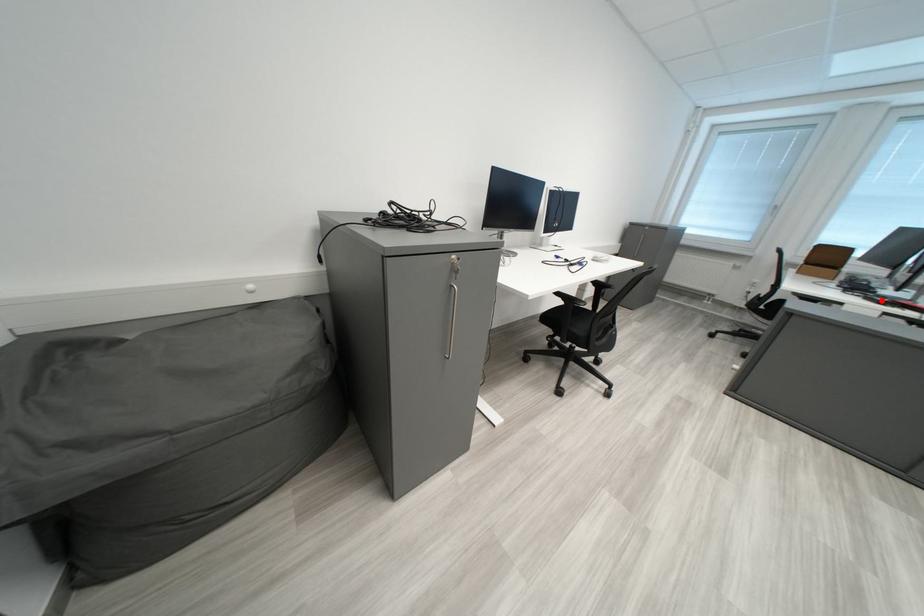
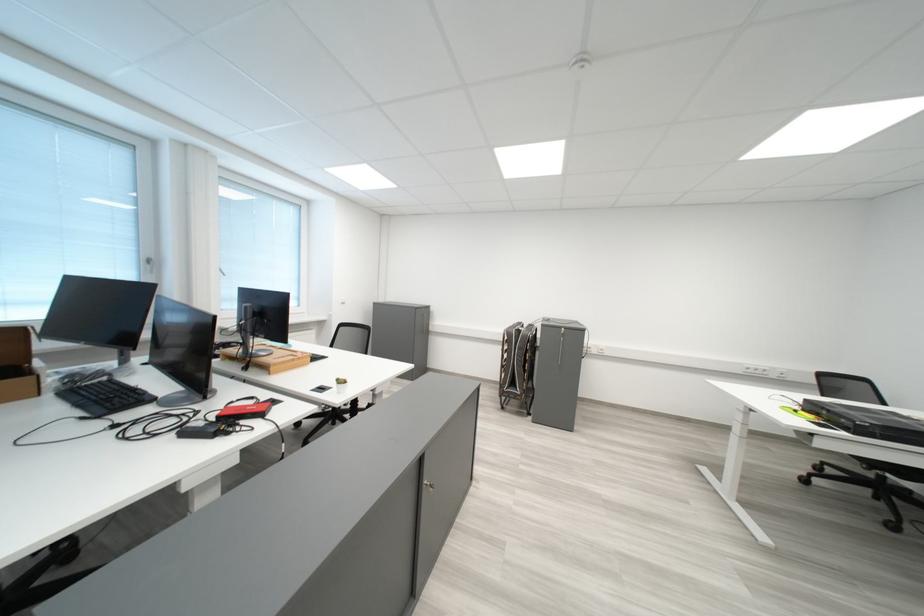
Find the pixel in the second image that matches the highlighted location in the first image.

(200, 436)